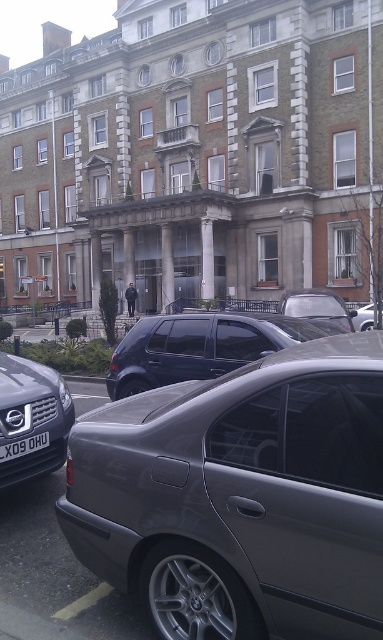
You are a delivery driver approaching the building and need to park your metallic silver car at center. The parking spot requires that your car must be to the left of the black plastic license plate at lower center. Can you park your car in this spot based on the current position?

The metallic silver car at center is positioned on the right side of the black plastic license plate at lower center, so it is currently not parked to the left of the black plastic license plate at lower center. You need to adjust your position to ensure the car is to the left of the license plate.

You are a delivery driver who needs to park your vehicle in the parking spot near the building. You see a matte black car at left and a black plastic license plate at lower center. Which object is closer to you as you approach the parking area?

The matte black car at left is closer to you because it is in front of the black plastic license plate at lower center.

You are standing at the point labeled as point (317, 307) in the image. What object are you touching?

You are touching the metallic silver car at center because the point (317, 307) is located on it.